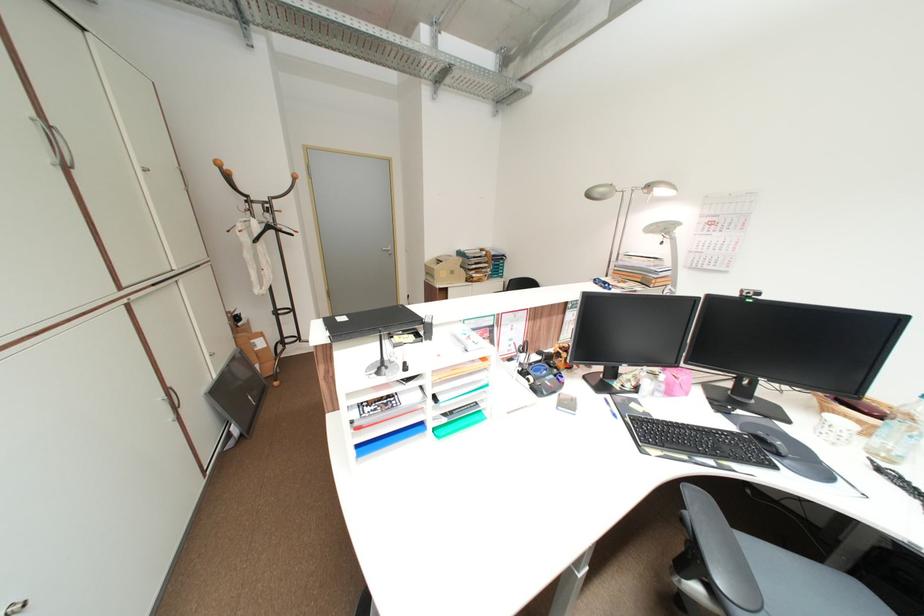
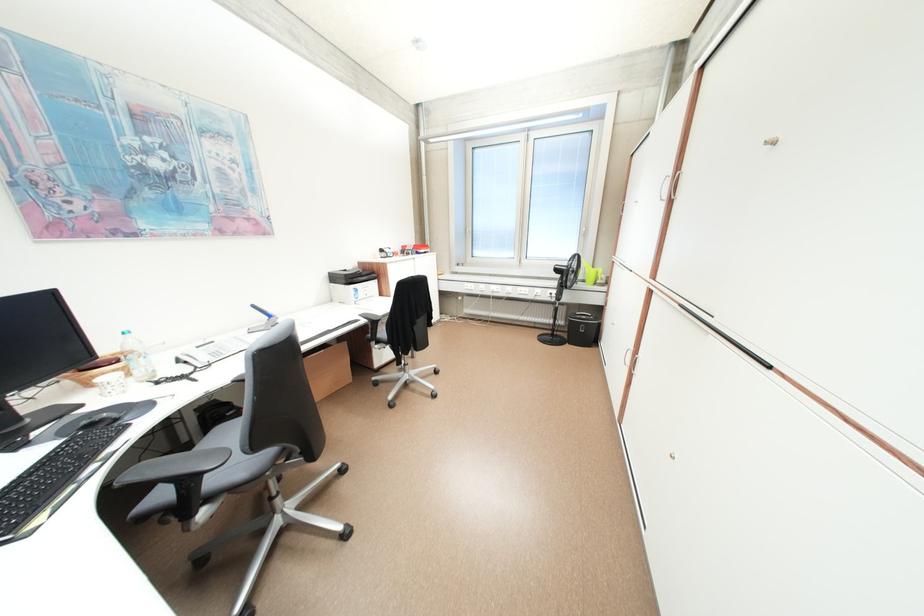
Find the pixel in the second image that matches pixel 876 435 in the first image.

(138, 374)